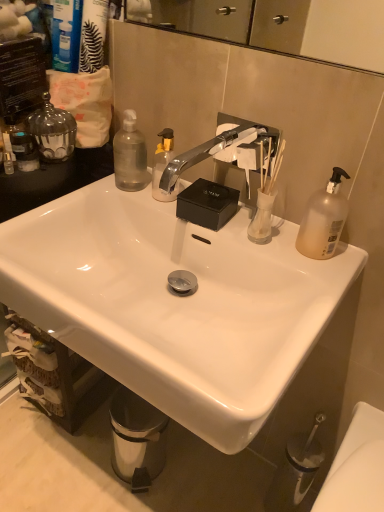
This screenshot has width=384, height=512. I want to click on free point below white glossy sink at center (from a real-world perspective), so click(145, 475).